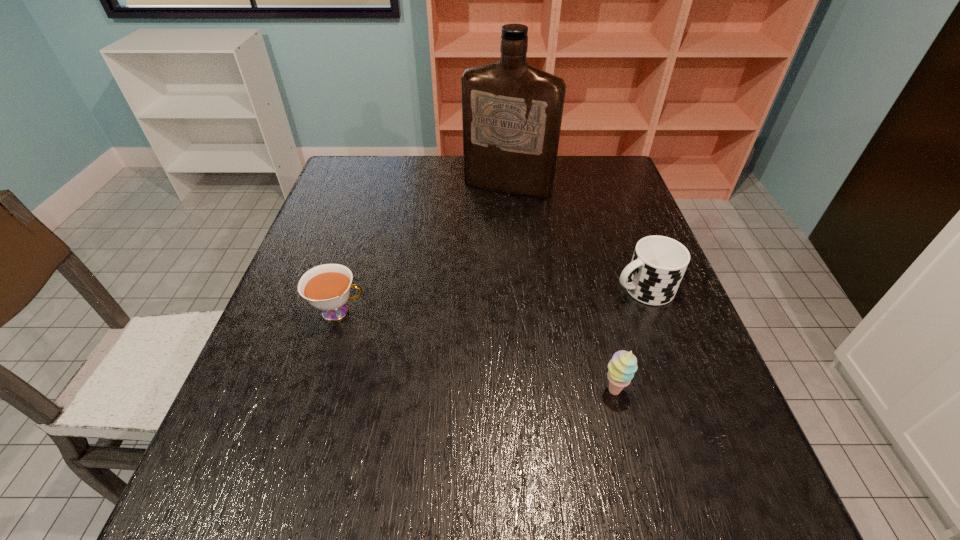
Where is `vacant space at the left edge of the desktop`? vacant space at the left edge of the desktop is located at coordinates (375, 202).

Locate an element on the screen. vacant space at the right edge is located at coordinates (668, 364).

Locate an element on the screen. The width and height of the screenshot is (960, 540). free region at the far left corner is located at coordinates (348, 180).

At what (x,y) coordinates should I click in order to perform the action: click on vacant space at the far right corner of the desktop. Please return your answer as a coordinate pair (x, y). The width and height of the screenshot is (960, 540). Looking at the image, I should click on (575, 157).

Identify the location of free point between the cup and the shortest object. Image resolution: width=960 pixels, height=540 pixels. (491, 300).

What are the coordinates of `free space between the rightmost object and the nearest object` in the screenshot? It's located at (628, 339).

Image resolution: width=960 pixels, height=540 pixels. I want to click on free spot between the shortest object and the sherbert, so click(476, 351).

Image resolution: width=960 pixels, height=540 pixels. In order to click on vacant space that is in between the liquor and the cup in this screenshot , I will do `click(575, 238)`.

I want to click on vacant space that is in between the sherbert and the shortest object, so click(x=476, y=351).

What are the coordinates of `free space that is in between the third object from left to right and the leftmost object` in the screenshot? It's located at tap(476, 351).